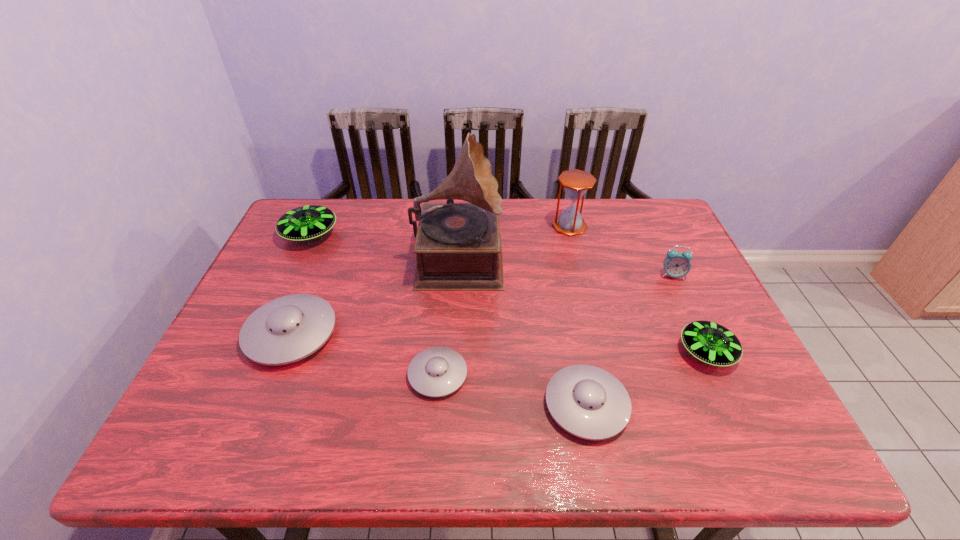
Where is `the tallest object`? This screenshot has width=960, height=540. the tallest object is located at coordinates point(458,245).

Locate an element on the screen. The width and height of the screenshot is (960, 540). the seventh shortest object is located at coordinates click(576, 182).

Where is `hourglass`? The height and width of the screenshot is (540, 960). hourglass is located at coordinates (576, 182).

Where is `alarm clock`? Image resolution: width=960 pixels, height=540 pixels. alarm clock is located at coordinates (676, 264).

This screenshot has height=540, width=960. In order to click on the left green saucer in this screenshot , I will do `click(305, 223)`.

Locate an element on the screen. Image resolution: width=960 pixels, height=540 pixels. the farther green saucer is located at coordinates (305, 223).

Find the location of `the leftmost gray saucer`. the leftmost gray saucer is located at coordinates (287, 329).

Locate an element on the screen. The height and width of the screenshot is (540, 960). the right green saucer is located at coordinates (709, 342).

The image size is (960, 540). In order to click on the rightmost saucer in this screenshot , I will do `click(709, 342)`.

The height and width of the screenshot is (540, 960). Find the location of `the second smallest gray saucer`. the second smallest gray saucer is located at coordinates (588, 402).